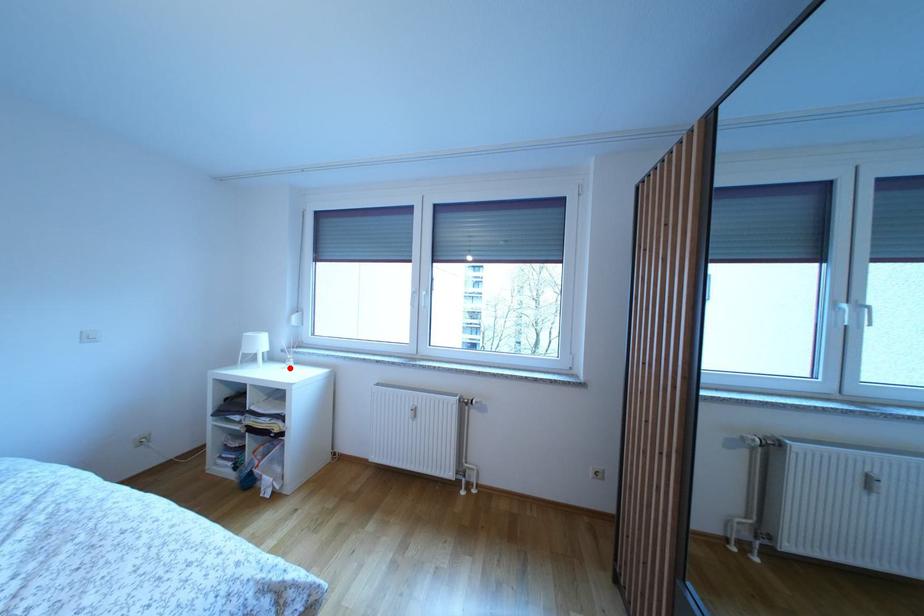
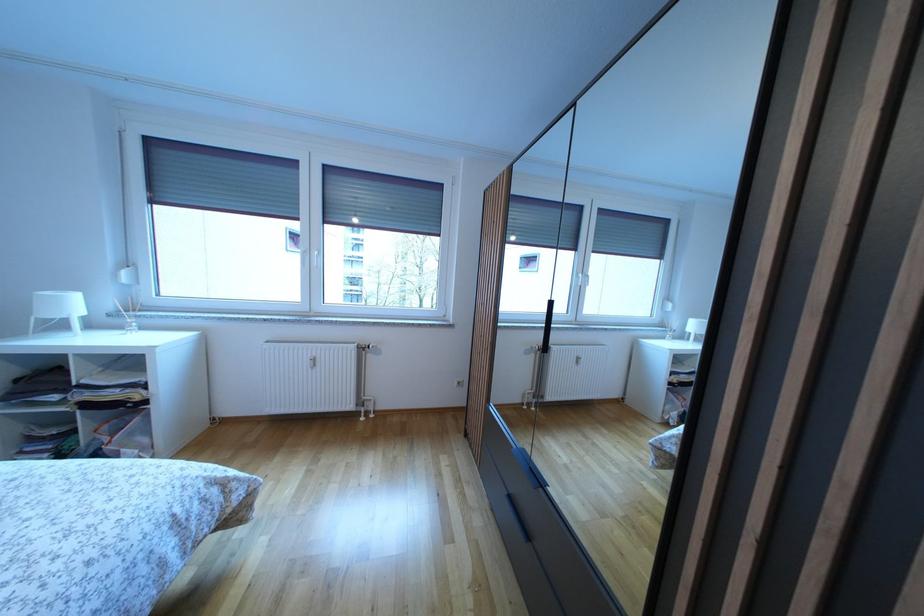
Find the pixel in the second image that matches the highlighted location in the first image.

(126, 334)